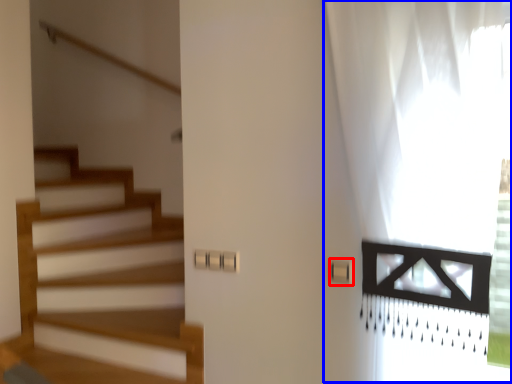
Question: Which point is closer to the camera, light switch (highlighted by a red box) or curtain (highlighted by a blue box)?

Choices:
 (A) light switch
 (B) curtain

Answer: (B)